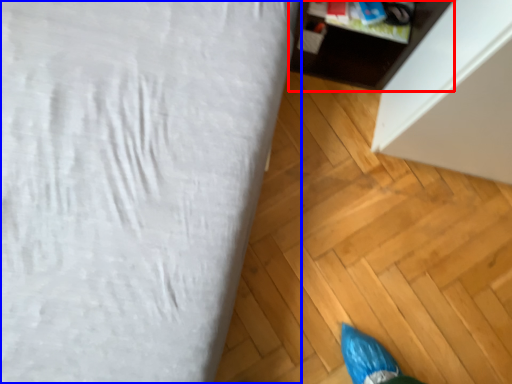
Question: Which object appears closest to the camera in this image, furniture (highlighted by a red box) or furniture (highlighted by a blue box)?

Choices:
 (A) furniture
 (B) furniture

Answer: (B)